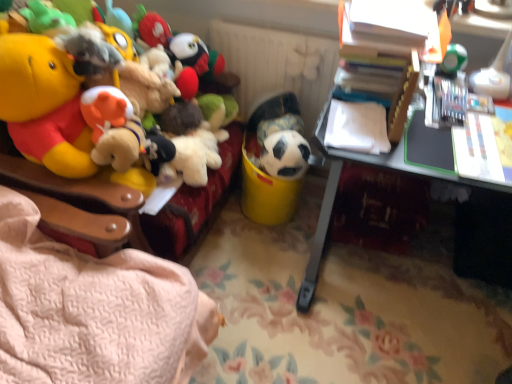
Question: Should I look upward or downward to see white plastic desk at right?

Choices:
 (A) down
 (B) up

Answer: (A)

Question: Can you confirm if white matte radiator at upper center is thinner than black matte soccer ball at center, the 2th toy positioned from the right?

Choices:
 (A) no
 (B) yes

Answer: (B)

Question: Does white matte radiator at upper center have a greater height compared to black matte soccer ball at center, marked as the third toy in a left-to-right arrangement?

Choices:
 (A) no
 (B) yes

Answer: (B)

Question: From the image's perspective, is white matte radiator at upper center on top of black matte soccer ball at center, the 2th toy positioned from the right?

Choices:
 (A) yes
 (B) no

Answer: (A)

Question: Can you confirm if white matte radiator at upper center is positioned to the left of black matte soccer ball at center, marked as the third toy in a left-to-right arrangement?

Choices:
 (A) yes
 (B) no

Answer: (A)

Question: Is there a large distance between white matte radiator at upper center and black matte soccer ball at center, the 2th toy positioned from the right?

Choices:
 (A) yes
 (B) no

Answer: (B)

Question: Is white matte radiator at upper center positioned beyond the bounds of black matte soccer ball at center, the 2th toy positioned from the right?

Choices:
 (A) yes
 (B) no

Answer: (A)

Question: Is white plastic desk at right taller than soccer ball at center, the 2th toy in the left-to-right sequence?

Choices:
 (A) yes
 (B) no

Answer: (A)

Question: Considering the relative sizes of white plastic desk at right and soccer ball at center, placed as the 3th toy when sorted from right to left, in the image provided, is white plastic desk at right shorter than soccer ball at center, placed as the 3th toy when sorted from right to left,?

Choices:
 (A) yes
 (B) no

Answer: (B)

Question: From a real-world perspective, is white plastic desk at right located beneath soccer ball at center, the 2th toy in the left-to-right sequence?

Choices:
 (A) yes
 (B) no

Answer: (A)

Question: Is white plastic desk at right far from soccer ball at center, the 2th toy in the left-to-right sequence?

Choices:
 (A) no
 (B) yes

Answer: (A)

Question: Is white plastic desk at right next to soccer ball at center, the 2th toy in the left-to-right sequence, and touching it?

Choices:
 (A) no
 (B) yes

Answer: (A)

Question: Is white plastic desk at right wider than soccer ball at center, the 2th toy in the left-to-right sequence?

Choices:
 (A) no
 (B) yes

Answer: (B)

Question: Is white matte radiator at upper center beside green matte die at upper right, which is counted as the 1th toy, starting from the right?

Choices:
 (A) yes
 (B) no

Answer: (B)